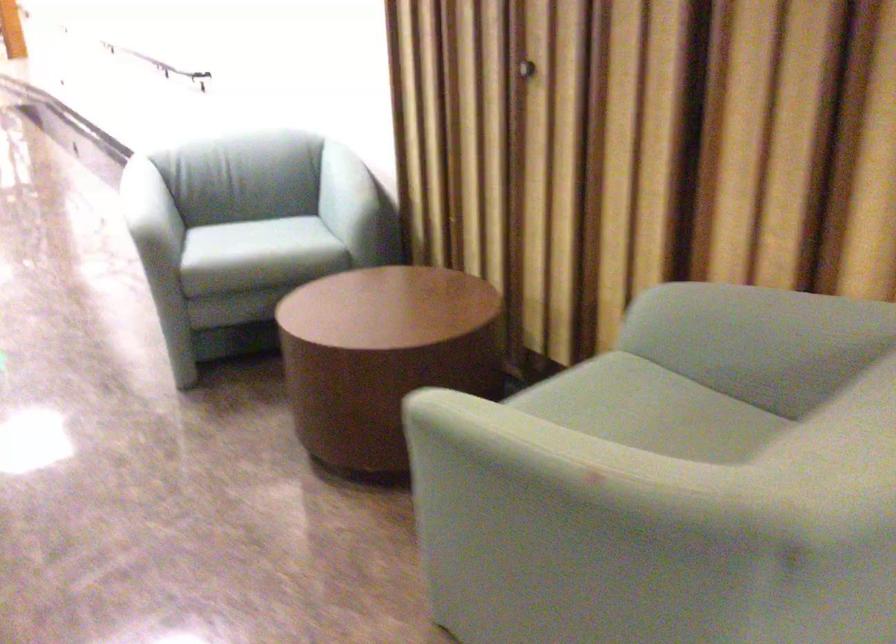
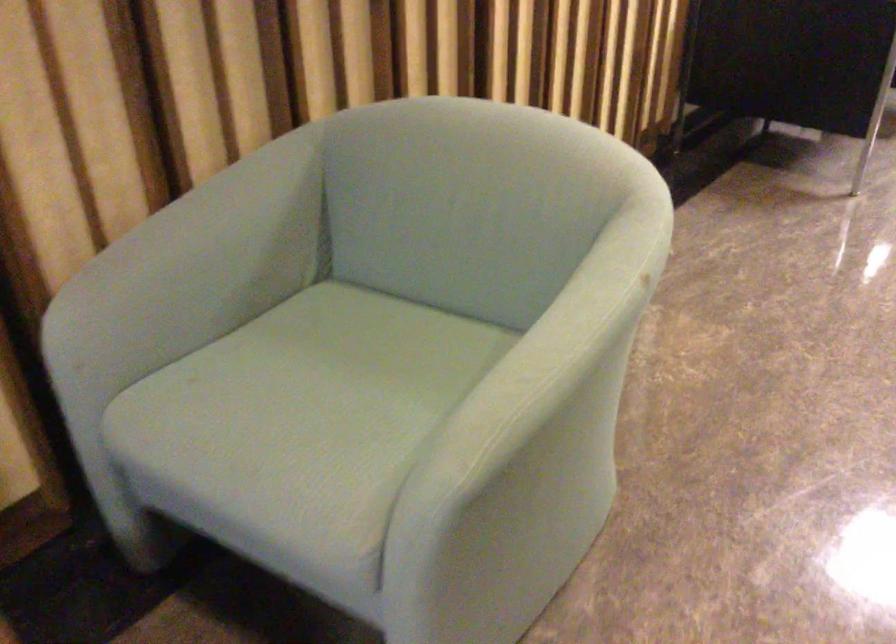
In the second image, find the point that corresponds to point (720, 319) in the first image.

(192, 269)